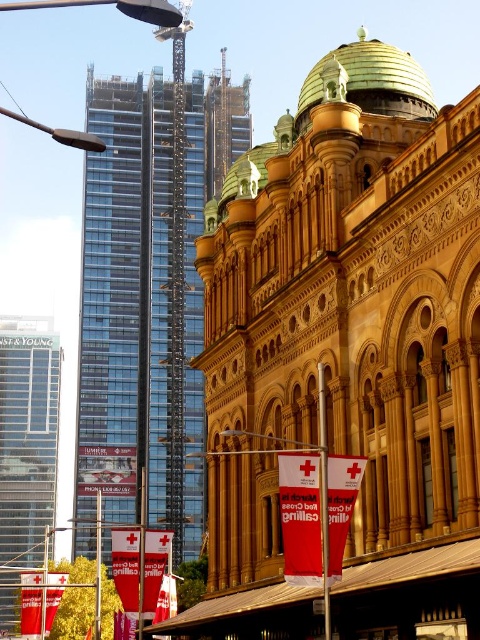
You are a city planner assessing the urban landscape. You need to determine if the glassy steel tower at left will block sunlight to the metallic pole at center. Given their widths, which one is wider?

The glassy steel tower at left is wider than the metallic pole at center, so it is more likely to block sunlight to the metallic pole at center.

You are standing in the middle of the image and see the point marked at coordinates (324, 497). What object is located at this point?

The point at coordinates (324, 497) corresponds to the red plastic pole at center.